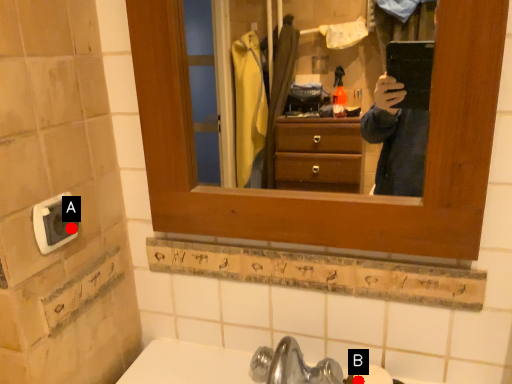
Question: Two points are circled on the image, labeled by A and B beside each circle. Which point appears closest to the camera in this image?

Choices:
 (A) A is closer
 (B) B is closer

Answer: (A)